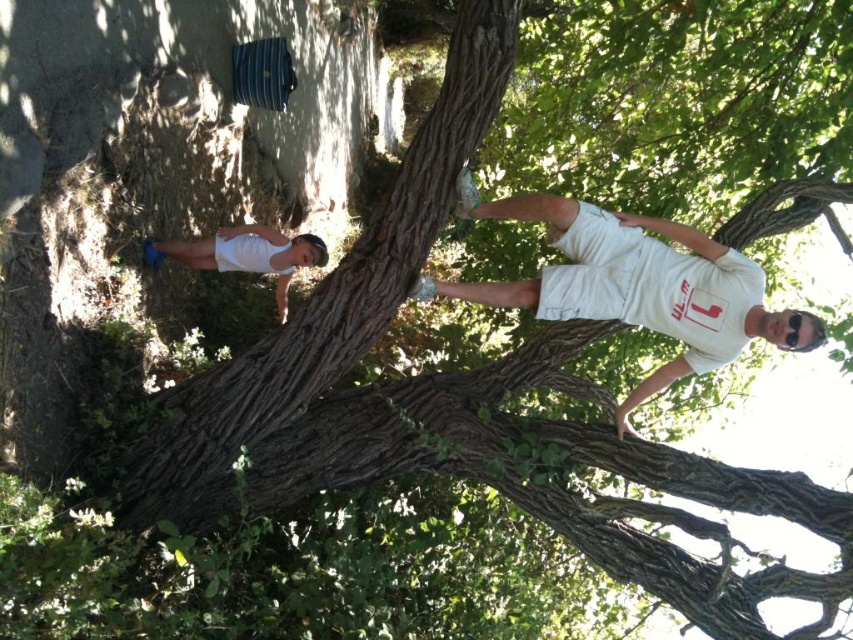
You are a fashion designer observing the scene and need to create outfits for both individuals. Given the spatial relationship between the white cotton shirt at upper right and white matte shorts at lower left, which clothing item should you prioritize in terms of size when designing the outfit?

The white cotton shirt at upper right is bigger than the white matte shorts at lower left, so you should prioritize designing the larger white cotton shirt at upper right first to ensure proper fit and proportion with the shorts.

You are a photographer trying to capture a candid shot of the scene. You notice the white cotton shirt at upper right and the white matte shorts at lower left. Which clothing item is closer to the camera based on their positions?

The white cotton shirt at upper right is positioned under the white matte shorts at lower left, so the white matte shorts at lower left are closer to the camera.

You are designing a new clothing line and need to ensure that the white cotton shirt at upper right and the white matte shorts at lower left can be worn together. Based on their sizes, will the shirt adequately cover the shorts when worn?

The white cotton shirt at upper right might be wider than white matte shorts at lower left, so it is possible that the shirt will cover the shorts when worn, but there is some uncertainty due to the potential size difference.